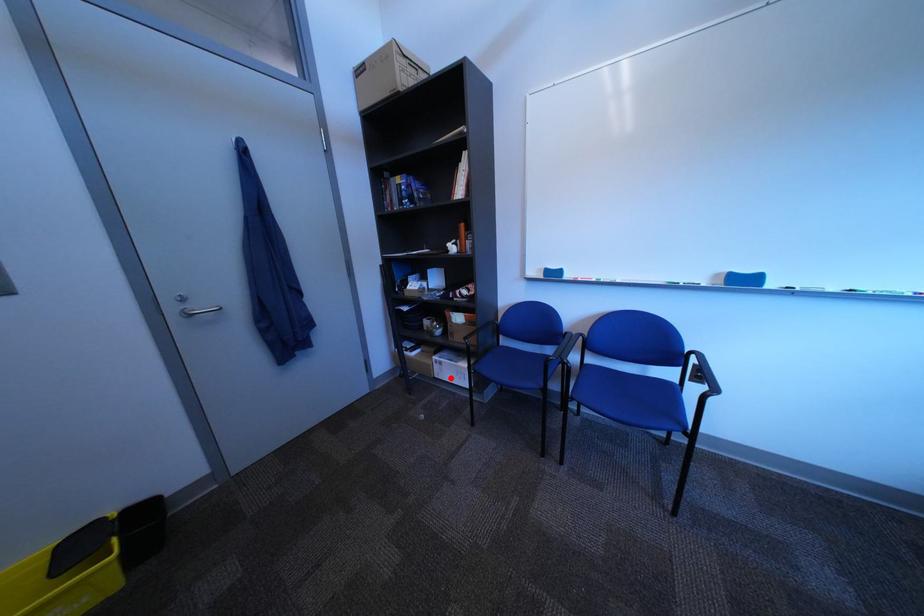
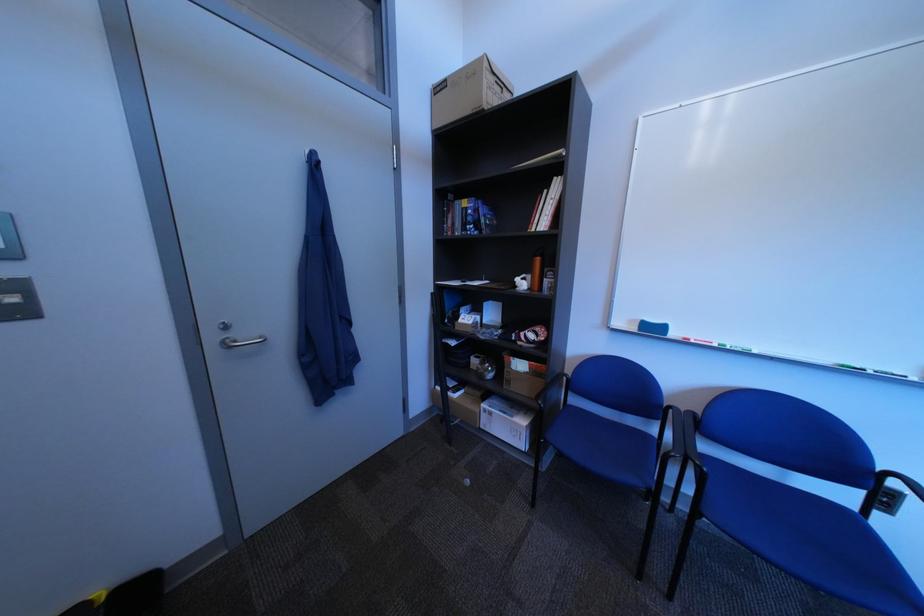
Where in the second image is the point corresponding to the highlighted location from the first image?

(496, 429)